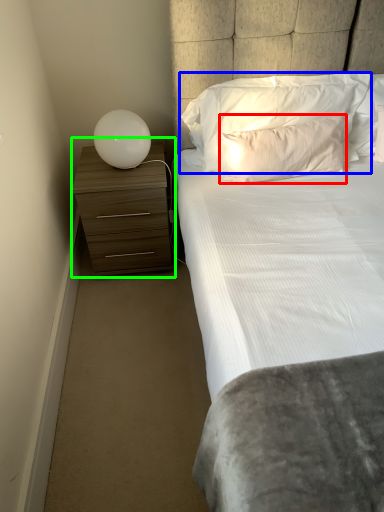
Question: Which is farther away from pillow (highlighted by a red box)? pillow (highlighted by a blue box) or chest of drawers (highlighted by a green box)?

Choices:
 (A) pillow
 (B) chest of drawers

Answer: (B)